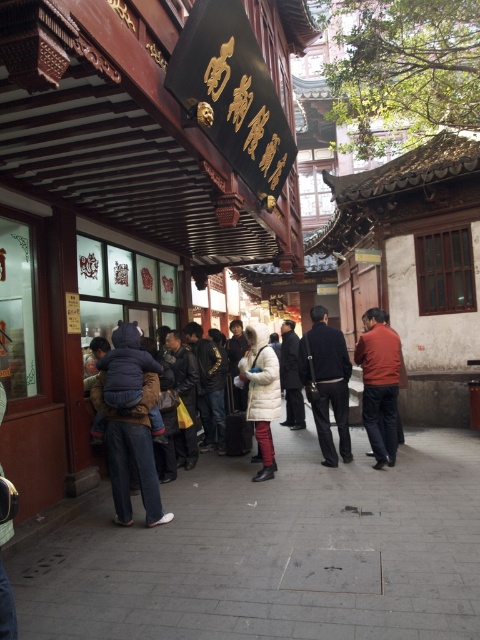
Question: Which point is closer to the camera?

Choices:
 (A) (205, 449)
 (B) (263, 426)
 (C) (287, 388)

Answer: (B)

Question: From the image, what is the correct spatial relationship of concrete pavement at center in relation to orange cotton jacket at center?

Choices:
 (A) right
 (B) left

Answer: (B)

Question: Which of the following is the farthest from the observer?

Choices:
 (A) (388, 332)
 (B) (422, 541)
 (C) (211, 346)

Answer: (C)

Question: Is black matte jacket at center in front of dark gray suit at center?

Choices:
 (A) no
 (B) yes

Answer: (B)

Question: Which point is closer to the camera?

Choices:
 (A) (362, 554)
 (B) (384, 381)
 (C) (286, 333)

Answer: (A)

Question: Can you confirm if black matte jacket at center is smaller than dark gray suit at center?

Choices:
 (A) no
 (B) yes

Answer: (B)